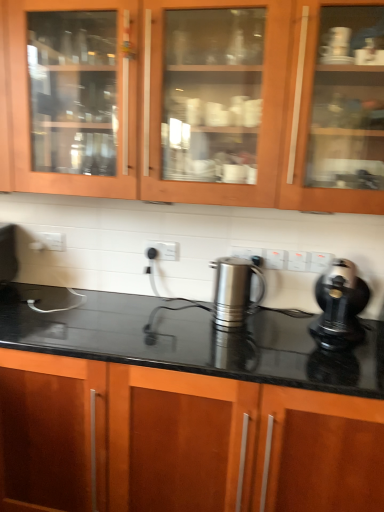
Question: Is black glossy countertop at center, which is the first cabinetry from bottom to top, oriented away from black plastic kettle at right?

Choices:
 (A) yes
 (B) no

Answer: (B)

Question: Would you say black glossy countertop at center, which is the first cabinetry from bottom to top, is outside black plastic kettle at right?

Choices:
 (A) yes
 (B) no

Answer: (A)

Question: Is the surface of black glossy countertop at center, which is the first cabinetry from bottom to top, in direct contact with black plastic kettle at right?

Choices:
 (A) yes
 (B) no

Answer: (B)

Question: Could you tell me if black glossy countertop at center, arranged as the second cabinetry when viewed from the top, is turned towards black plastic kettle at right?

Choices:
 (A) yes
 (B) no

Answer: (B)

Question: Can you confirm if black glossy countertop at center, arranged as the second cabinetry when viewed from the top, is smaller than black plastic kettle at right?

Choices:
 (A) yes
 (B) no

Answer: (B)

Question: Is black glossy countertop at center, arranged as the second cabinetry when viewed from the top, spatially inside matte wood cabinets at upper center, acting as the 2th cabinetry starting from the bottom, or outside of it?

Choices:
 (A) inside
 (B) outside

Answer: (B)

Question: From a real-world perspective, relative to matte wood cabinets at upper center, acting as the 2th cabinetry starting from the bottom, is black glossy countertop at center, which is the first cabinetry from bottom to top, vertically above or below?

Choices:
 (A) above
 (B) below

Answer: (B)

Question: Is point (26, 499) closer or farther from the camera than point (221, 112)?

Choices:
 (A) closer
 (B) farther

Answer: (B)

Question: Considering their positions, is black glossy countertop at center, arranged as the second cabinetry when viewed from the top, located in front of or behind matte wood cabinets at upper center, arranged as the first cabinetry when viewed from the top?

Choices:
 (A) behind
 (B) front

Answer: (B)

Question: Considering the positions of polished stainless steel kettle at center and black glossy countertop at center, which is the first cabinetry from bottom to top, in the image, is polished stainless steel kettle at center bigger or smaller than black glossy countertop at center, which is the first cabinetry from bottom to top,?

Choices:
 (A) big
 (B) small

Answer: (B)

Question: From a real-world perspective, is polished stainless steel kettle at center positioned above or below black glossy countertop at center, which is the first cabinetry from bottom to top?

Choices:
 (A) below
 (B) above

Answer: (B)

Question: Is polished stainless steel kettle at center inside or outside of black glossy countertop at center, which is the first cabinetry from bottom to top?

Choices:
 (A) outside
 (B) inside

Answer: (A)

Question: From the image's perspective, relative to black glossy countertop at center, arranged as the second cabinetry when viewed from the top, is polished stainless steel kettle at center above or below?

Choices:
 (A) below
 (B) above

Answer: (B)

Question: Is point (334, 345) closer or farther from the camera than point (57, 65)?

Choices:
 (A) closer
 (B) farther

Answer: (A)

Question: Considering the positions of black plastic kettle at right and matte wood cabinets at upper center, acting as the 2th cabinetry starting from the bottom, in the image, is black plastic kettle at right taller or shorter than matte wood cabinets at upper center, acting as the 2th cabinetry starting from the bottom,?

Choices:
 (A) short
 (B) tall

Answer: (A)